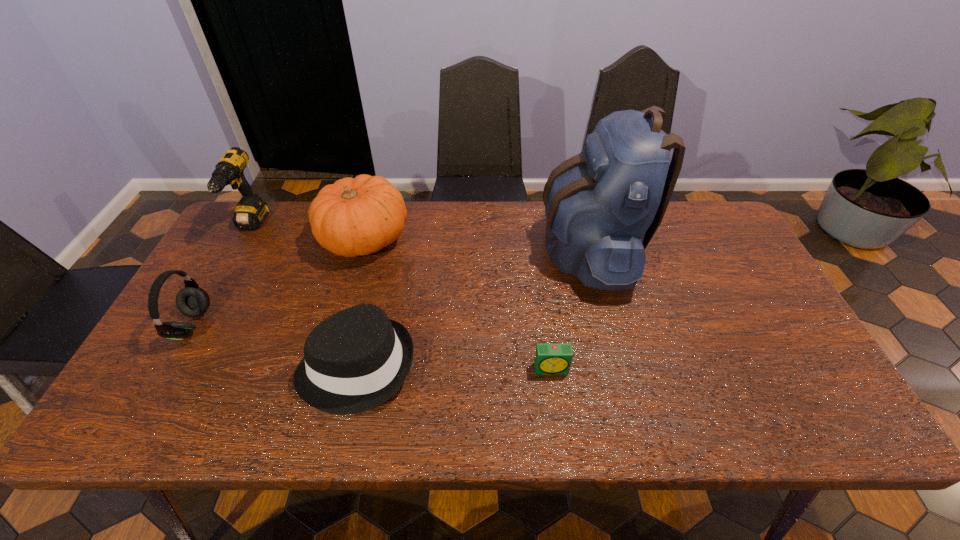
This screenshot has width=960, height=540. I want to click on the tallest object, so click(x=603, y=206).

Find the location of a particular element. the fifth shortest object is located at coordinates (250, 212).

Locate an element on the screen. This screenshot has height=540, width=960. pumpkin is located at coordinates (356, 216).

Locate an element on the screen. The height and width of the screenshot is (540, 960). headset is located at coordinates (192, 301).

This screenshot has width=960, height=540. I want to click on fedora, so [x=355, y=360].

This screenshot has width=960, height=540. I want to click on alarm clock, so click(x=550, y=358).

At what (x,y) coordinates should I click in order to perform the action: click on vacant space located 0.060m at the front pocket of the backpack. Please return your answer as a coordinate pair (x, y). Looking at the image, I should click on coord(521,248).

The height and width of the screenshot is (540, 960). Identify the location of vacant area located at the front pocket of the backpack. (423, 248).

The image size is (960, 540). Find the location of `vacant space situated at the front pocket of the backpack`. vacant space situated at the front pocket of the backpack is located at coordinates point(498,248).

I want to click on free space located 0.090m at the tip of the drill, so click(x=228, y=268).